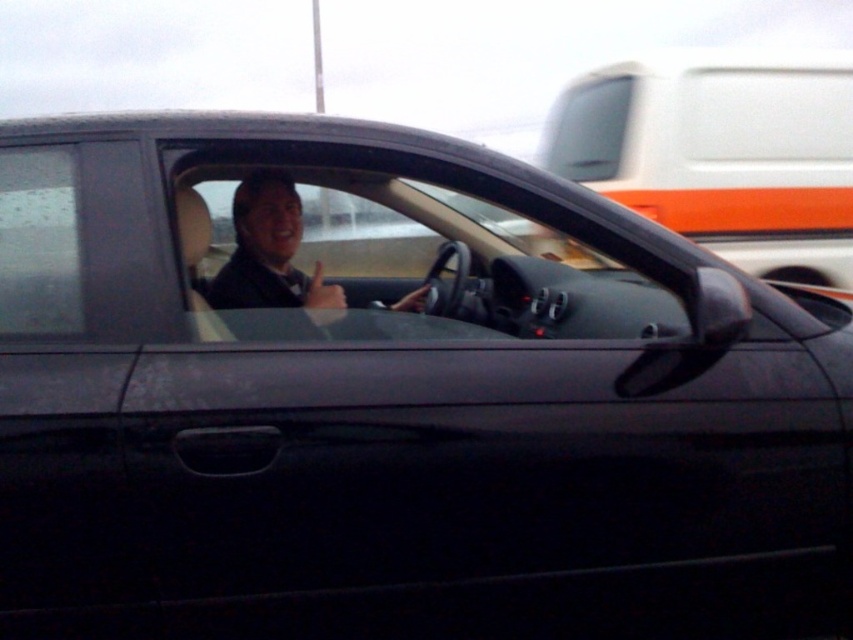
Question: Can you confirm if transparent glass window at center is positioned to the left of matte black suit at center?

Choices:
 (A) yes
 (B) no

Answer: (B)

Question: Among these points, which one is farthest from the camera?

Choices:
 (A) (485, 337)
 (B) (250, 205)

Answer: (B)

Question: Does transparent glass window at center have a lesser width compared to matte black suit at center?

Choices:
 (A) no
 (B) yes

Answer: (A)

Question: Which point appears closest to the camera in this image?

Choices:
 (A) (224, 268)
 (B) (306, 326)

Answer: (B)

Question: Is transparent glass window at center bigger than matte black suit at center?

Choices:
 (A) no
 (B) yes

Answer: (B)

Question: Which of the following is the farthest from the observer?

Choices:
 (A) (260, 179)
 (B) (445, 272)

Answer: (B)